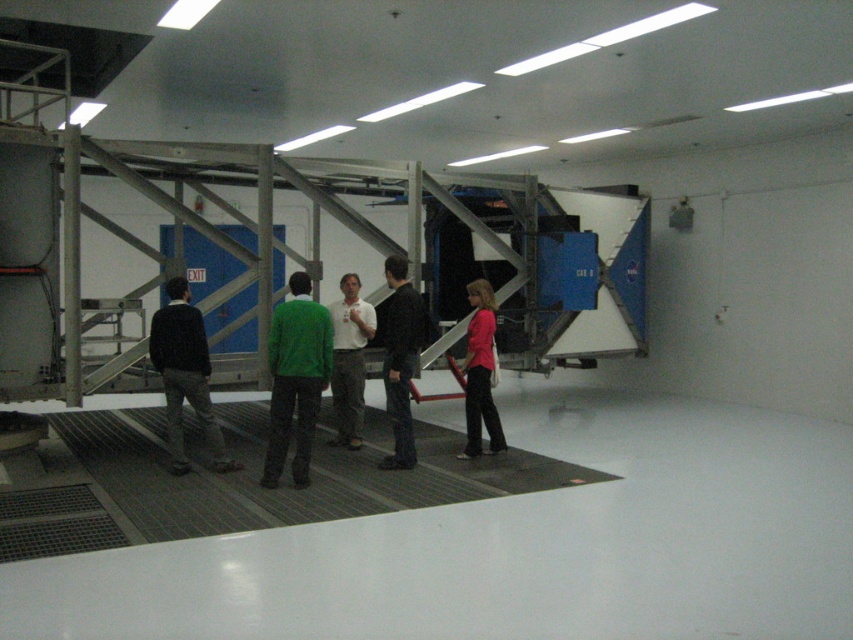
Question: Estimate the real-world distances between objects in this image. Which object is farther from the dark gray sweater at left?

Choices:
 (A) green matte sweater at center
 (B) white shirt at center

Answer: (B)

Question: Estimate the real-world distances between objects in this image. Which object is farther from the pink matte shirt at center?

Choices:
 (A) dark gray sweater at left
 (B) dark blue jeans at center

Answer: (A)

Question: In this image, where is dark blue jeans at center located relative to white shirt at center?

Choices:
 (A) above
 (B) below

Answer: (A)

Question: Is green matte sweater at center wider than dark gray sweater at left?

Choices:
 (A) yes
 (B) no

Answer: (B)

Question: Which object is positioned farthest from the pink matte shirt at center?

Choices:
 (A) dark gray sweater at left
 (B) green matte sweater at center

Answer: (A)

Question: Is dark gray sweater at left positioned in front of white shirt at center?

Choices:
 (A) yes
 (B) no

Answer: (A)